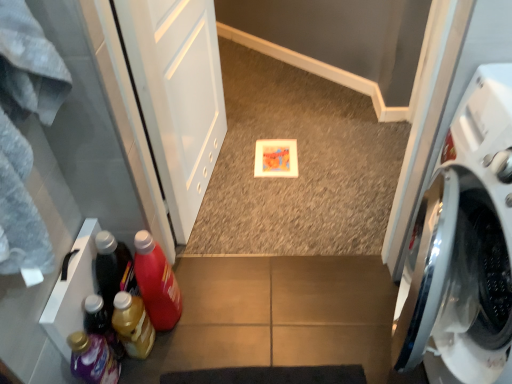
Question: Are translucent plastic detergent at lower left, acting as the 1th bottle starting from the left, and translucent yellow bottle at lower left, which is the 2th bottle from right to left, beside each other?

Choices:
 (A) no
 (B) yes

Answer: (A)

Question: Are translucent plastic detergent at lower left, which ranks as the 4th bottle in right-to-left order, and translucent yellow bottle at lower left, the 3th bottle when ordered from left to right, far apart?

Choices:
 (A) yes
 (B) no

Answer: (B)

Question: Is translucent plastic detergent at lower left, which ranks as the 4th bottle in right-to-left order, positioned before translucent yellow bottle at lower left, the 3th bottle when ordered from left to right?

Choices:
 (A) no
 (B) yes

Answer: (B)

Question: Does translucent plastic detergent at lower left, which ranks as the 4th bottle in right-to-left order, come behind translucent yellow bottle at lower left, which is the 2th bottle from right to left?

Choices:
 (A) yes
 (B) no

Answer: (B)

Question: Does translucent plastic detergent at lower left, which ranks as the 4th bottle in right-to-left order, have a greater width compared to translucent yellow bottle at lower left, the 3th bottle when ordered from left to right?

Choices:
 (A) no
 (B) yes

Answer: (A)

Question: Does translucent plastic detergent at lower left, which ranks as the 4th bottle in right-to-left order, have a smaller size compared to translucent yellow bottle at lower left, the 3th bottle when ordered from left to right?

Choices:
 (A) yes
 (B) no

Answer: (A)

Question: Can you confirm if translucent plastic detergent at lower left, acting as the 1th bottle starting from the left, is taller than translucent plastic bottle at lower left, the 3th bottle from the right?

Choices:
 (A) no
 (B) yes

Answer: (B)

Question: Is translucent plastic detergent at lower left, which ranks as the 4th bottle in right-to-left order, to the left of translucent plastic bottle at lower left, which is the second bottle from left to right, from the viewer's perspective?

Choices:
 (A) yes
 (B) no

Answer: (A)

Question: Can you confirm if translucent plastic detergent at lower left, acting as the 1th bottle starting from the left, is positioned to the right of translucent plastic bottle at lower left, the 3th bottle from the right?

Choices:
 (A) no
 (B) yes

Answer: (A)

Question: Is translucent plastic detergent at lower left, which ranks as the 4th bottle in right-to-left order, aimed at translucent plastic bottle at lower left, the 3th bottle from the right?

Choices:
 (A) yes
 (B) no

Answer: (B)

Question: Is translucent plastic detergent at lower left, acting as the 1th bottle starting from the left, further to camera compared to translucent plastic bottle at lower left, which is the second bottle from left to right?

Choices:
 (A) yes
 (B) no

Answer: (B)

Question: Could translucent plastic bottle at lower left, which is the second bottle from left to right, be considered to be inside translucent plastic detergent at lower left, which ranks as the 4th bottle in right-to-left order?

Choices:
 (A) yes
 (B) no

Answer: (B)

Question: Can you see translucent plastic bottle at lower left, which is the second bottle from left to right, touching matte plastic bottle at lower left, positioned as the fourth bottle in left-to-right order?

Choices:
 (A) yes
 (B) no

Answer: (B)